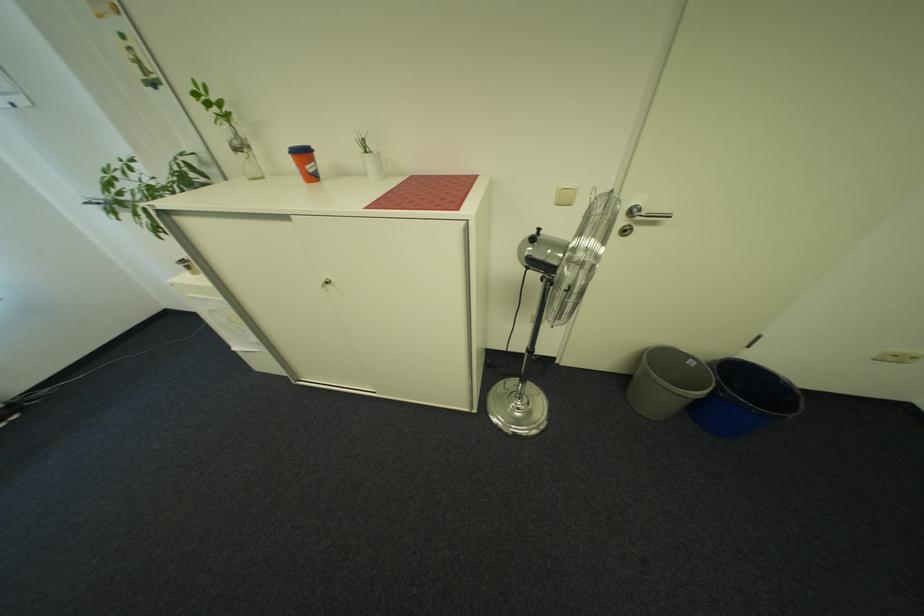
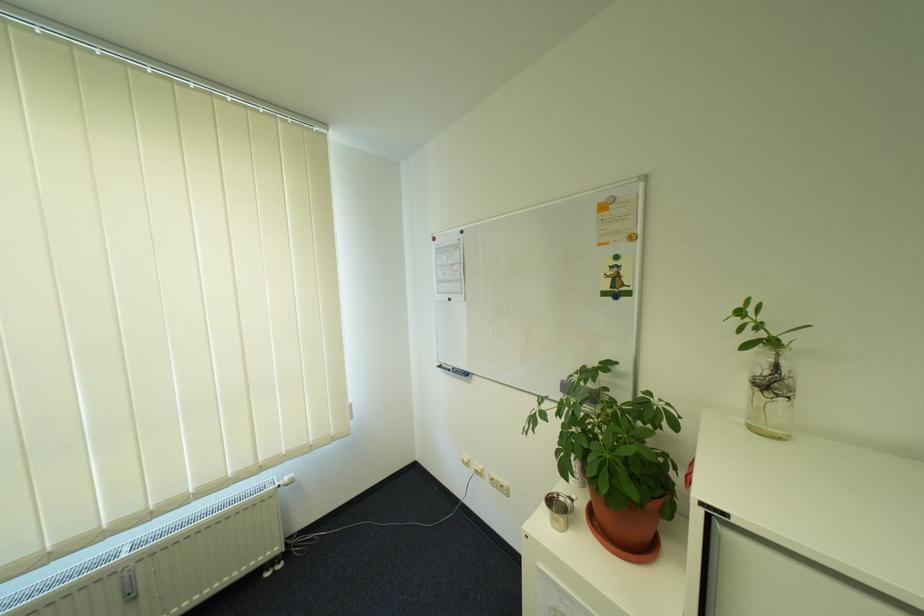
Locate, in the second image, the point that corresponds to point (107, 205) in the first image.

(458, 371)